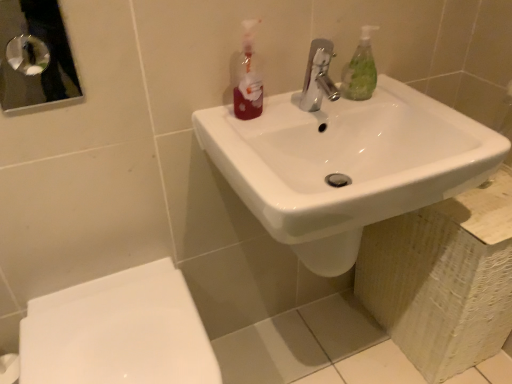
Identify the location of vacant region to the right of green translucent soap dispenser at upper right. (405, 102).